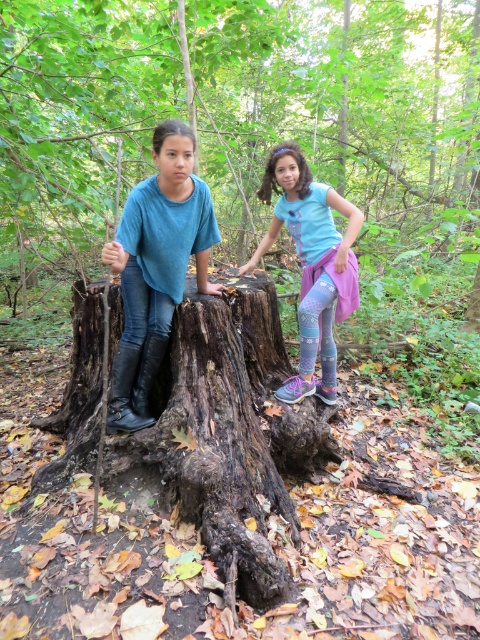
Question: Where is matte blue shirt at center located in relation to light blue t-shirt at center in the image?

Choices:
 (A) left
 (B) right

Answer: (A)

Question: Does dark brown rough tree trunk at center appear on the left side of matte blue shirt at center?

Choices:
 (A) yes
 (B) no

Answer: (A)

Question: Considering the real-world distances, which object is closest to the matte blue shirt at center?

Choices:
 (A) dark brown rough tree trunk at center
 (B) light blue t-shirt at center

Answer: (A)

Question: Is dark brown rough tree trunk at center further to camera compared to matte blue shirt at center?

Choices:
 (A) yes
 (B) no

Answer: (B)

Question: Among these points, which one is nearest to the camera?

Choices:
 (A) (x=137, y=200)
 (B) (x=310, y=310)
 (C) (x=250, y=561)

Answer: (C)

Question: Among these objects, which one is nearest to the camera?

Choices:
 (A) dark brown rough tree trunk at center
 (B) matte blue shirt at center

Answer: (A)